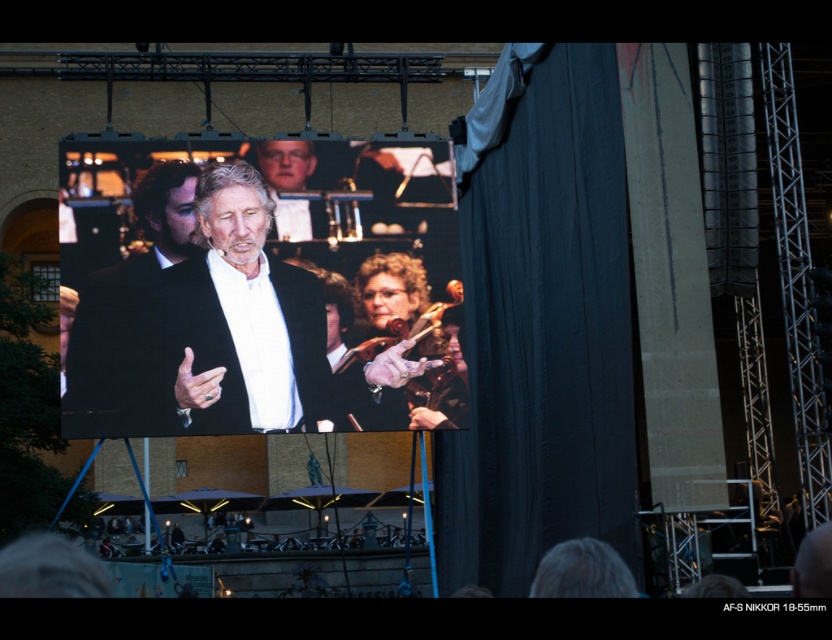
You are a stagehand who needs to move a 3.5 meter long ladder from the dark fabric curtain at right to the leather glove at center. Can you safely transport the ladder horizontally between these two objects without tilting it?

The distance between the dark fabric curtain at right and leather glove at center is 7.63 meters. Since the ladder is only 3.5 meters long, there is enough space to move it horizontally without tilting.

You are an event organizer checking the stage setup. You need to ensure that the dark fabric curtain at right and the leather glove at center are both visible to the audience. Given their sizes, which object might be more easily seen from the back of the venue?

The dark fabric curtain at right is larger in size than the leather glove at center, so it would be more easily seen from the back of the venue.

You are a photographer at the event and want to focus on both the point at coordinates point (x=164, y=180) and point (x=424, y=406). Which point should you adjust your camera focus to first to ensure both are in focus?

Point (x=164, y=180) is further to the camera than point (x=424, y=406). To ensure both are in focus, adjust the focus to the closer point first, which is point (x=424, y=406), then the further point (x=164, y=180).